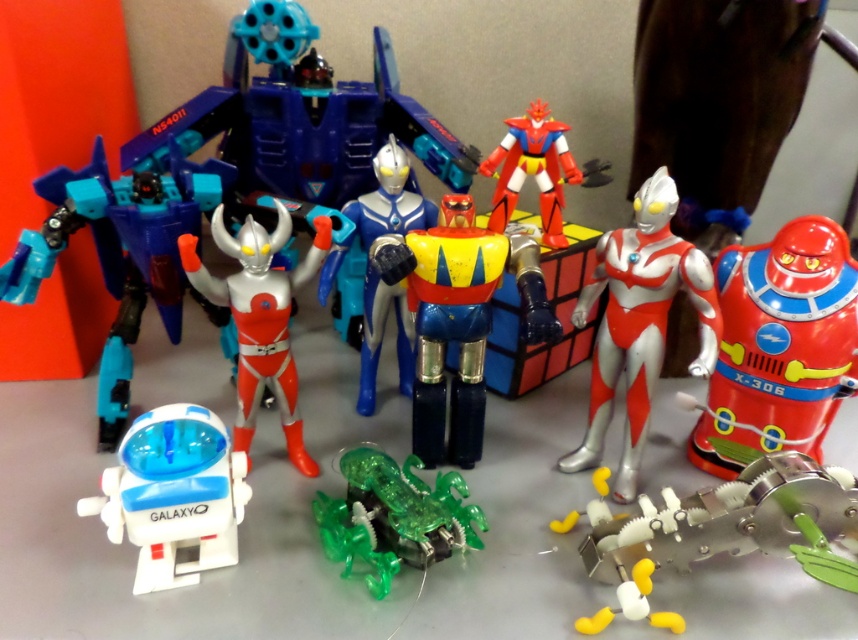
You are a toy collector who wants to place a new 1.5 meter long dragon toy between the metallic blue robot at center and the Ultraman figures. Is there enough space between them to fit the dragon toy?

The distance between the metallic blue robot at center and the Ultraman figures is 1.05 meters, which is shorter than the dragon toy length of 1.5 meters. Therefore, there is not enough space to fit the dragon toy between them.

You are a toy collector examining the arrangement of two points marked in the image. The first point is at coordinate point (437, 435) and the second is at point (710, 324). Which point is closer to you as you look at the image?

Point (437, 435) is closer to you than point (710, 324) because it is further to the viewer according to the description.

You are a collector who wants to display both the metallic blue robot at center and the shiny silver figure at center on a shelf. Based on their sizes, which one should you place on the lower shelf to ensure they are both visible?

The metallic blue robot at center is shorter than the shiny silver figure at center, so place the metallic blue robot at center on the lower shelf so that both can be seen clearly.